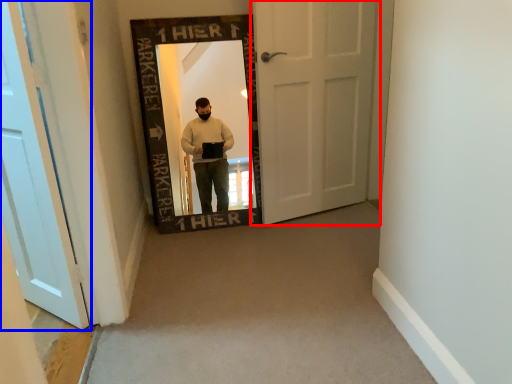
Question: Which object is closer to the camera taking this photo, door (highlighted by a red box) or door (highlighted by a blue box)?

Choices:
 (A) door
 (B) door

Answer: (B)